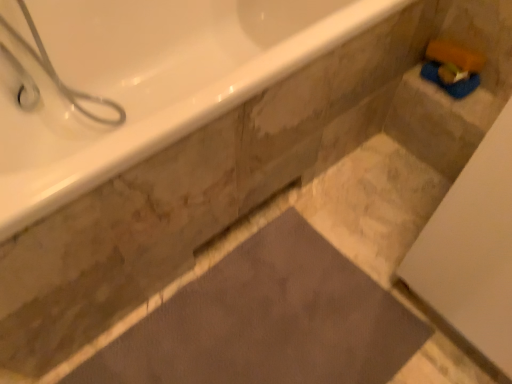
Question: Looking at the image, does white glossy bathtub at upper left seem bigger or smaller compared to dark gray matte bath mat at center?

Choices:
 (A) big
 (B) small

Answer: (A)

Question: Is white glossy bathtub at upper left to the left or to the right of dark gray matte bath mat at center in the image?

Choices:
 (A) left
 (B) right

Answer: (A)

Question: Considering the real-world distances, which object is farthest from the white glossy shower at upper left?

Choices:
 (A) white glossy bathtub at upper left
 (B) dark gray matte bath mat at center

Answer: (B)

Question: Estimate the real-world distances between objects in this image. Which object is closer to the dark gray matte bath mat at center?

Choices:
 (A) white glossy shower at upper left
 (B) white glossy bathtub at upper left

Answer: (B)